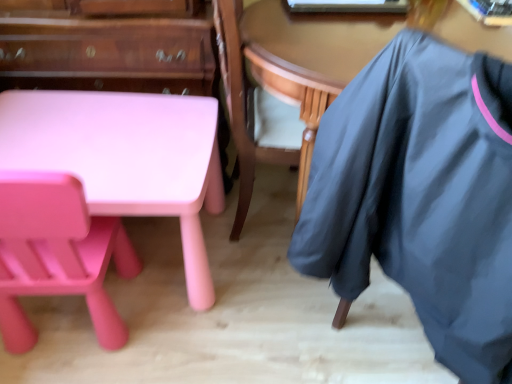
Where is `vacant area that lies between matte pink chair at lower left and matte pink plastic desk at lower left`? This screenshot has width=512, height=384. vacant area that lies between matte pink chair at lower left and matte pink plastic desk at lower left is located at coordinates (165, 326).